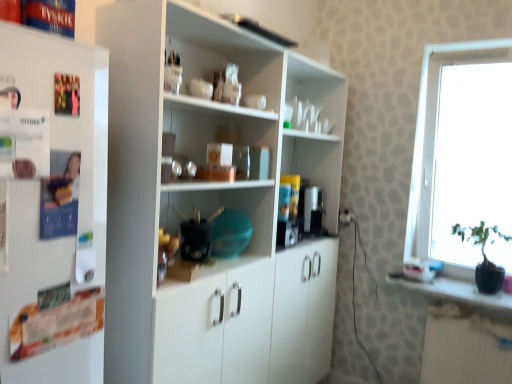
This screenshot has width=512, height=384. Describe the element at coordinates (316, 166) in the screenshot. I see `matte plastic coffee machine at center` at that location.

Locate an element on the screen. The height and width of the screenshot is (384, 512). matte plastic coffee machine at center is located at coordinates (316, 166).

Which object is further away from the camera taking this photo, black glossy pot at right or white matte cupboard at center?

black glossy pot at right is further from the camera.

Does black glossy pot at right have a smaller size compared to white matte cupboard at center?

Yes.

From the image's perspective, which object appears higher, black glossy pot at right or white matte cupboard at center?

white matte cupboard at center, from the image's perspective.

Is white matte refrigerator at left next to matte plastic coffee machine at center and touching it?

No, white matte refrigerator at left is not with matte plastic coffee machine at center.

From a real-world perspective, is white matte refrigerator at left located higher than matte plastic coffee machine at center?

Yes, from a real-world perspective, white matte refrigerator at left is over matte plastic coffee machine at center

Does white matte refrigerator at left have a greater height compared to matte plastic coffee machine at center?

Yes.

In terms of width, does white matte refrigerator at left look wider or thinner when compared to matte plastic coffee machine at center?

white matte refrigerator at left is thinner than matte plastic coffee machine at center.

From a real-world perspective, is transparent glass window at right beneath white matte refrigerator at left?

A: Incorrect, from a real-world perspective, transparent glass window at right is higher than white matte refrigerator at left.

Measure the distance from transparent glass window at right to white matte refrigerator at left.

transparent glass window at right is 7.28 feet from white matte refrigerator at left.

Considering the sizes of objects transparent glass window at right and white matte refrigerator at left in the image provided, who is wider, transparent glass window at right or white matte refrigerator at left?

Wider between the two is transparent glass window at right.

Consider the image. Can you tell me how much white matte refrigerator at left and white matte cupboard at center differ in facing direction?

The angular difference between white matte refrigerator at left and white matte cupboard at center is 0.707 degrees.

Would you consider white matte refrigerator at left to be distant from white matte cupboard at center?

They are positioned close to each other.

From the image's perspective, relative to white matte cupboard at center, is white matte refrigerator at left above or below?

white matte refrigerator at left is above white matte cupboard at center.

Can you confirm if white matte refrigerator at left is bigger than white matte cupboard at center?

Actually, white matte refrigerator at left might be smaller than white matte cupboard at center.

Find the location of a particular element. The width and height of the screenshot is (512, 384). counter top below the transparent glass window at right (from the image's perspective) is located at coordinates (454, 291).

Visually, is black glossy pot at right positioned to the left or to the right of transparent glass window at right?

Based on their positions, black glossy pot at right is located to the left of transparent glass window at right.

From the image's perspective, is black glossy pot at right on top of transparent glass window at right?

No, from the image's perspective, black glossy pot at right is not on top of transparent glass window at right.

Is black glossy pot at right aimed at transparent glass window at right?

No, black glossy pot at right is not oriented towards transparent glass window at right.

Does white matte cupboard at center appear on the left side of black glossy pot at right?

Yes, white matte cupboard at center is to the left of black glossy pot at right.

This screenshot has width=512, height=384. Find the location of `cupboard located on the left of black glossy pot at right`. cupboard located on the left of black glossy pot at right is located at coordinates (214, 207).

Consider the image. From a real-world perspective, is white matte refrigerator at left on black glossy pot at right?

Yes, from a real-world perspective, white matte refrigerator at left is over black glossy pot at right

Is white matte refrigerator at left not inside black glossy pot at right?

Yes, white matte refrigerator at left is located beyond the bounds of black glossy pot at right.

This screenshot has height=384, width=512. I want to click on refrigerator above the black glossy pot at right (from the image's perspective), so click(52, 203).

Can you tell me how much white matte refrigerator at left and black glossy pot at right differ in facing direction?

The angular difference between white matte refrigerator at left and black glossy pot at right is 90.9 degrees.

What are the coordinates of `counter top that appears below the white matte cupboard at center (from the image's perspective)` in the screenshot? It's located at (454, 291).

The height and width of the screenshot is (384, 512). What are the coordinates of `shelf on the right of white matte refrigerator at left` in the screenshot? It's located at (316, 166).

Based on their spatial positions, is transparent glass window at right or black glossy pot at right closer to white matte refrigerator at left?

Among the two, black glossy pot at right is located nearer to white matte refrigerator at left.

Estimate the real-world distances between objects in this image. Which object is further from white matte cupboard at center, white matte refrigerator at left or black glossy pot at right?

black glossy pot at right is positioned further to the anchor white matte cupboard at center.

Which object lies further to the anchor point matte plastic coffee machine at center, white matte cupboard at center or white matte refrigerator at left?

white matte refrigerator at left is further to matte plastic coffee machine at center.

Which object lies nearer to the anchor point matte plastic coffee machine at center, black glossy pot at right or transparent glass window at right?

transparent glass window at right.

Which object lies nearer to the anchor point matte plastic coffee machine at center, transparent glass window at right or white matte cupboard at center?

white matte cupboard at center is positioned closer to the anchor matte plastic coffee machine at center.

From the image, which object appears to be nearer to black glossy pot at right, matte plastic coffee machine at center or white matte cupboard at center?

matte plastic coffee machine at center is closer to black glossy pot at right.

Estimate the real-world distances between objects in this image. Which object is further from white matte refrigerator at left, transparent glass window at right or matte plastic coffee machine at center?

transparent glass window at right.

From the image, which object appears to be nearer to black glossy pot at right, white matte refrigerator at left or white matte cupboard at center?

white matte cupboard at center is positioned closer to the anchor black glossy pot at right.

Locate an element on the screen. The width and height of the screenshot is (512, 384). cupboard between white matte refrigerator at left and transparent glass window at right is located at coordinates (214, 207).

Find the location of `counter top between matte plastic coffee machine at center and transparent glass window at right`. counter top between matte plastic coffee machine at center and transparent glass window at right is located at coordinates (454, 291).

This screenshot has width=512, height=384. Identify the location of counter top between white matte refrigerator at left and transparent glass window at right in the horizontal direction. (454, 291).

At what (x,y) coordinates should I click in order to perform the action: click on counter top between white matte cupboard at center and transparent glass window at right in the horizontal direction. Please return your answer as a coordinate pair (x, y). This screenshot has height=384, width=512. Looking at the image, I should click on (454, 291).